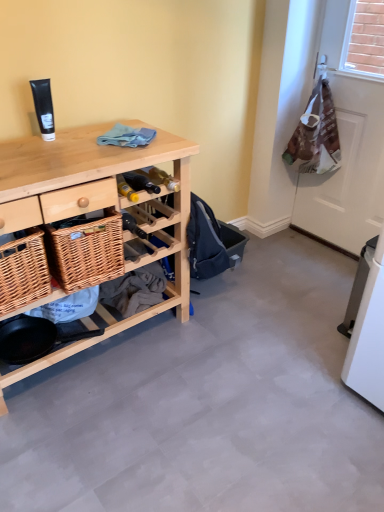
Question: Is black matte tube at upper left at the left side of brown paper bag at right?

Choices:
 (A) yes
 (B) no

Answer: (A)

Question: Does black matte tube at upper left have a smaller size compared to brown paper bag at right?

Choices:
 (A) no
 (B) yes

Answer: (B)

Question: From a real-world perspective, is black matte tube at upper left below brown paper bag at right?

Choices:
 (A) no
 (B) yes

Answer: (A)

Question: Are black matte tube at upper left and brown paper bag at right located far from each other?

Choices:
 (A) yes
 (B) no

Answer: (A)

Question: From the image's perspective, is black matte tube at upper left beneath brown paper bag at right?

Choices:
 (A) no
 (B) yes

Answer: (B)

Question: Is black matte tube at upper left outside brown paper bag at right?

Choices:
 (A) no
 (B) yes

Answer: (B)

Question: Can you confirm if blue cotton cloth at center is taller than brown paper bag at right?

Choices:
 (A) no
 (B) yes

Answer: (A)

Question: Are blue cotton cloth at center and brown paper bag at right far apart?

Choices:
 (A) yes
 (B) no

Answer: (A)

Question: From a real-world perspective, is blue cotton cloth at center beneath brown paper bag at right?

Choices:
 (A) yes
 (B) no

Answer: (B)

Question: From a real-world perspective, is blue cotton cloth at center on brown paper bag at right?

Choices:
 (A) yes
 (B) no

Answer: (A)

Question: Considering the relative positions of blue cotton cloth at center and brown paper bag at right in the image provided, is blue cotton cloth at center to the left of brown paper bag at right from the viewer's perspective?

Choices:
 (A) no
 (B) yes

Answer: (B)

Question: Is blue cotton cloth at center thinner than brown paper bag at right?

Choices:
 (A) yes
 (B) no

Answer: (B)

Question: Is brown paper bag at right not inside woven brown picnic basket at lower left?

Choices:
 (A) no
 (B) yes

Answer: (B)